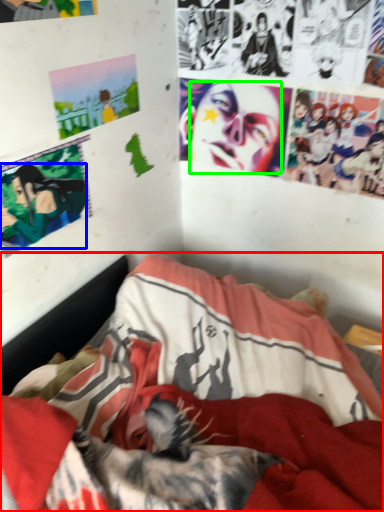
Question: Estimate the real-world distances between objects in this image. Which object is farther from bed (highlighted by a red box), person (highlighted by a blue box) or human face (highlighted by a green box)?

Choices:
 (A) person
 (B) human face

Answer: (B)